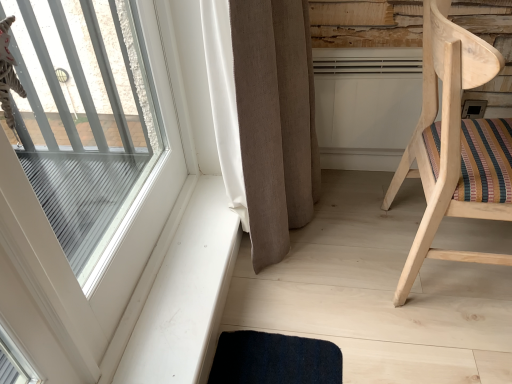
Identify the location of vacant space in front of beige fabric curtain at center. This screenshot has width=512, height=384. (316, 305).